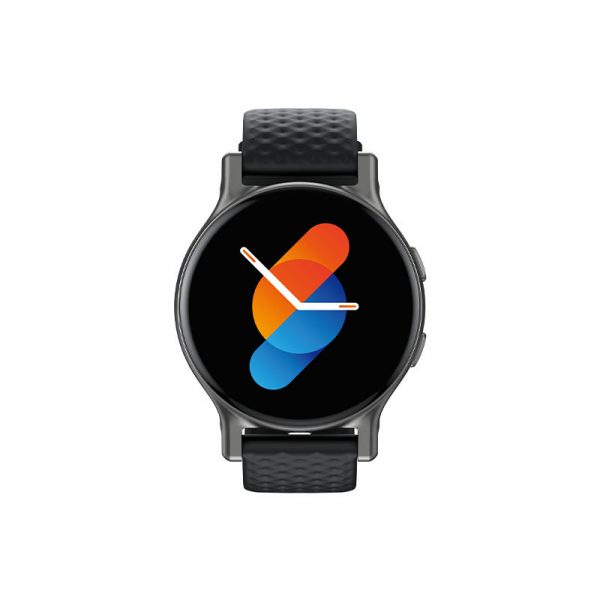
You are a GUI agent. You are given a task and a screenshot of the screen. Output one action in this format:
    pyautogui.click(x=<x>, y=<y>)
    Task: Click on the clock face
    
    Given the screenshot: What is the action you would take?
    pyautogui.click(x=225, y=332)